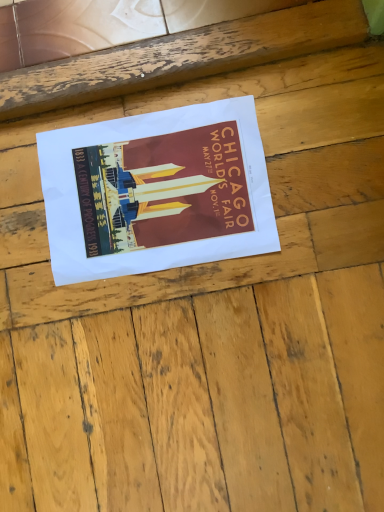
Question: Does wooden at center contain matte paper poster at center?

Choices:
 (A) no
 (B) yes

Answer: (B)

Question: Can you confirm if wooden at center is positioned to the right of matte paper poster at center?

Choices:
 (A) no
 (B) yes

Answer: (B)

Question: Can you confirm if wooden at center is taller than matte paper poster at center?

Choices:
 (A) yes
 (B) no

Answer: (A)

Question: From the image's perspective, would you say wooden at center is positioned over matte paper poster at center?

Choices:
 (A) yes
 (B) no

Answer: (B)

Question: Considering the relative sizes of wooden at center and matte paper poster at center in the image provided, is wooden at center shorter than matte paper poster at center?

Choices:
 (A) no
 (B) yes

Answer: (A)

Question: Is wooden at center to the left of matte paper poster at center from the viewer's perspective?

Choices:
 (A) no
 (B) yes

Answer: (A)

Question: Considering the relative positions of matte paper poster at center and wooden at center in the image provided, is matte paper poster at center to the left of wooden at center from the viewer's perspective?

Choices:
 (A) no
 (B) yes

Answer: (B)

Question: Does matte paper poster at center appear on the right side of wooden at center?

Choices:
 (A) no
 (B) yes

Answer: (A)

Question: Can you confirm if matte paper poster at center is smaller than wooden at center?

Choices:
 (A) no
 (B) yes

Answer: (B)

Question: Is matte paper poster at center positioned far away from wooden at center?

Choices:
 (A) no
 (B) yes

Answer: (A)

Question: Does matte paper poster at center have a lesser width compared to wooden at center?

Choices:
 (A) yes
 (B) no

Answer: (A)

Question: Is matte paper poster at center behind wooden at center?

Choices:
 (A) yes
 (B) no

Answer: (A)

Question: From a real-world perspective, is wooden at center positioned above or below matte paper poster at center?

Choices:
 (A) below
 (B) above

Answer: (B)